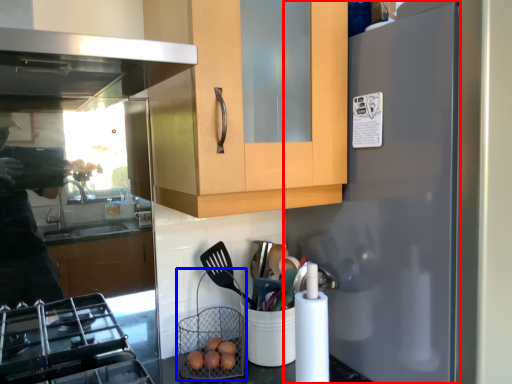
Question: Which object is closer to the camera taking this photo, refrigerator (highlighted by a red box) or basket (highlighted by a blue box)?

Choices:
 (A) refrigerator
 (B) basket

Answer: (A)